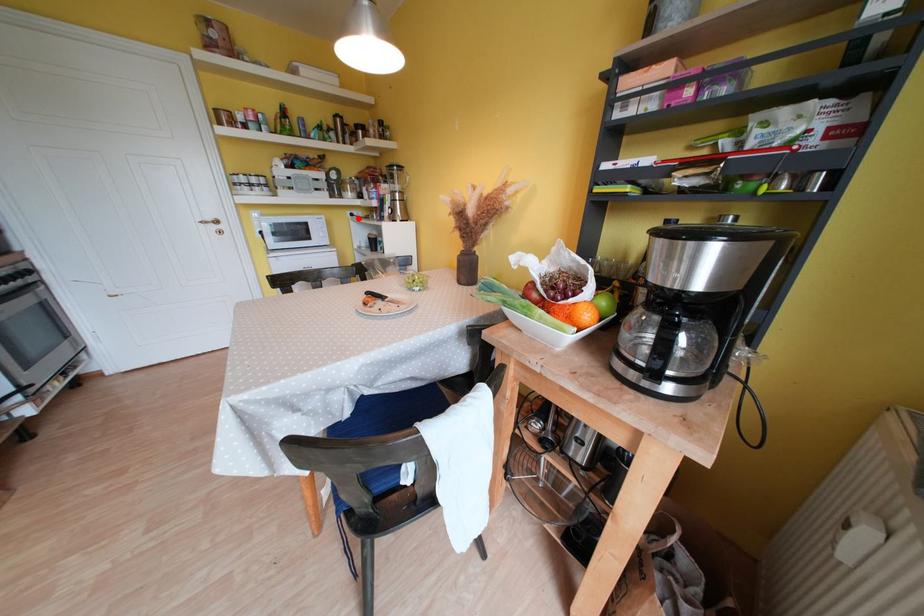
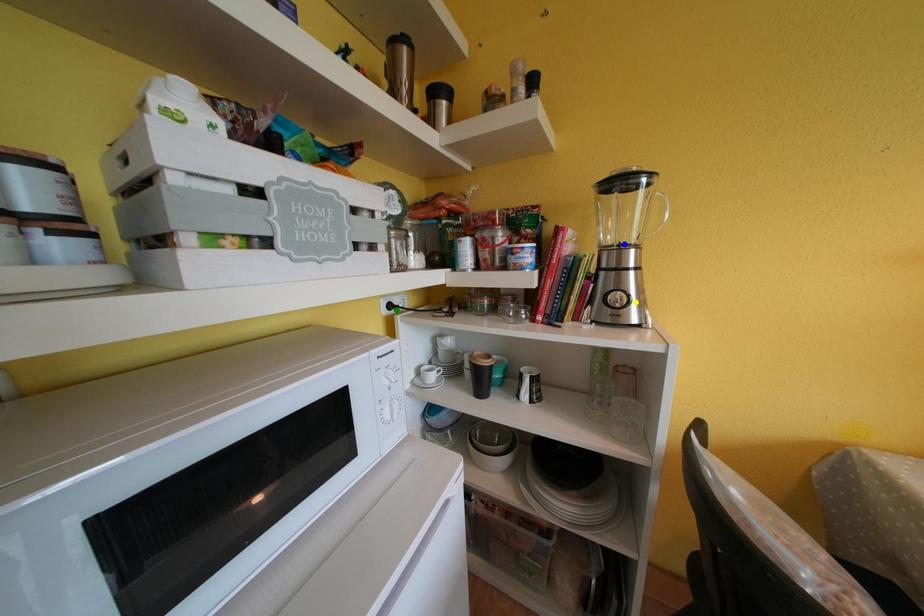
Question: I am providing you with two images of the same scene from different viewpoints. A red point is marked on the first image. You are given multiple points on the second image. In image 2, which mark is for the same physical point as the one in image 1?

Choices:
 (A) yellow point
 (B) blue point
 (C) green point

Answer: (C)